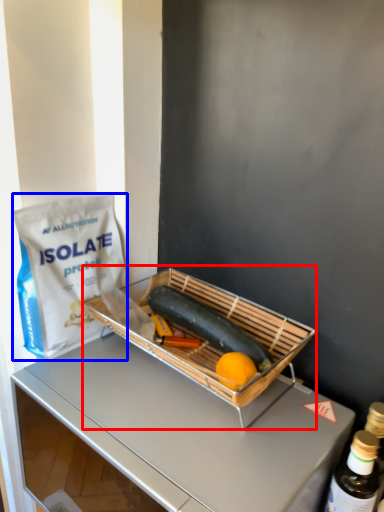
Question: Which of the following is the farthest to the observer, appliance (highlighted by a red box) or grocery bag (highlighted by a blue box)?

Choices:
 (A) appliance
 (B) grocery bag

Answer: (B)